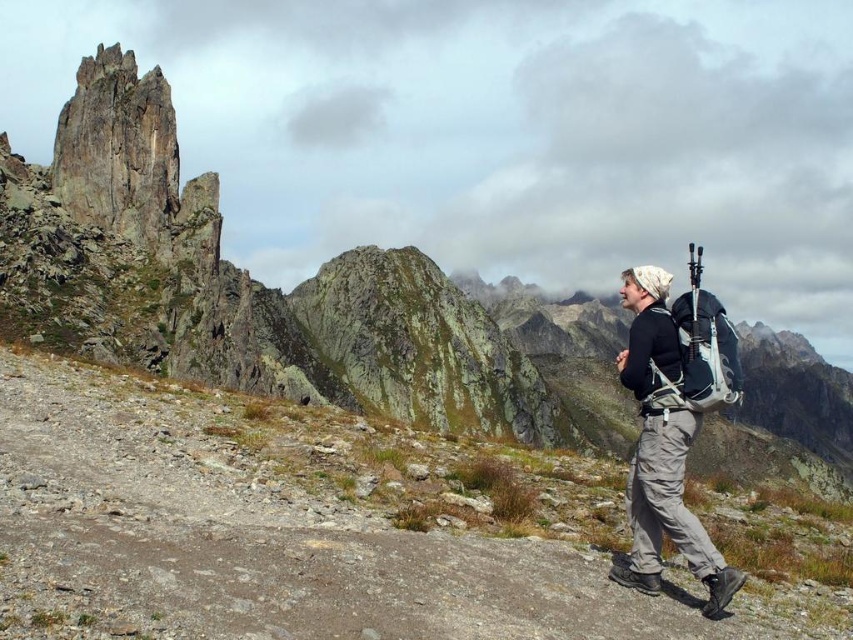
You are a hiker planning to set up camp on the rugged mountain trail. You have a tent that requires a flat area larger than the matte black backpack at right. Can you determine if the dull gray gravel at center is suitable for setting up the tent based on its size?

The dull gray gravel at center is bigger than the matte black backpack at right, so it is suitable for setting up the tent as it provides a flat area larger than the backpack.

You are a hiker planning to set up a tent on the mountain trail. The scene shows a point marked at coordinates (x=312, y=529) which is dull gray gravel at center. Considering the terrain described in the scene, is this location suitable for pitching a tent?

The point at coordinates (x=312, y=529) is dull gray gravel at center, which is a stable surface for setting up a tent. However, the scene mentions the terrain is rugged with sparse vegetation, so ensure the area is flat enough and free from loose rocks or hazards before pitching the tent.

You are a hiker planning to navigate between the two points marked in the image. Which point, point (219, 632) or point (669, 316), is closer to your current position?

Point (219, 632) is closer to the viewer than point (669, 316), so it is closer to your current position.